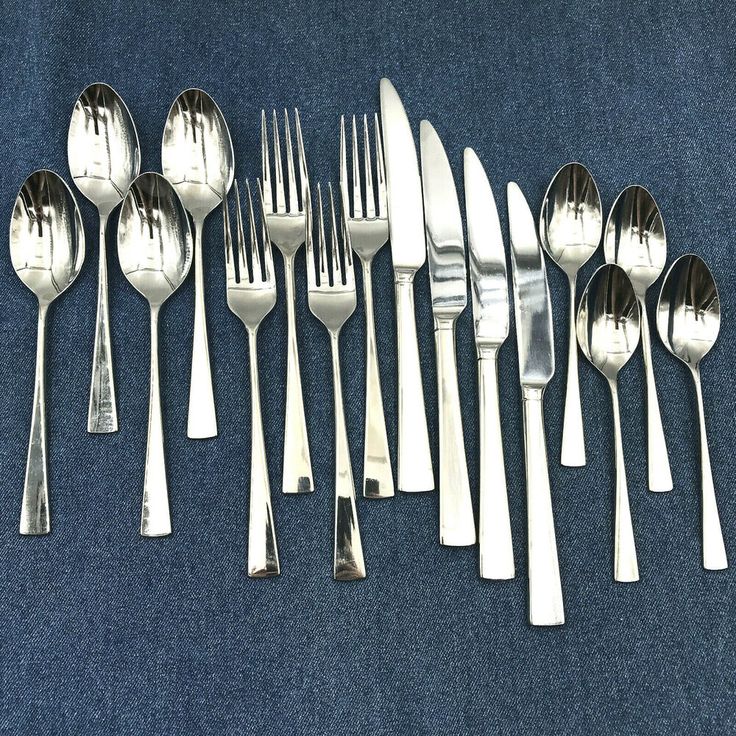
Locate an element on the screen. The height and width of the screenshot is (736, 736). spoons is located at coordinates (51, 233), (93, 158), (143, 243), (184, 151), (576, 216), (617, 322), (684, 322), (645, 241).